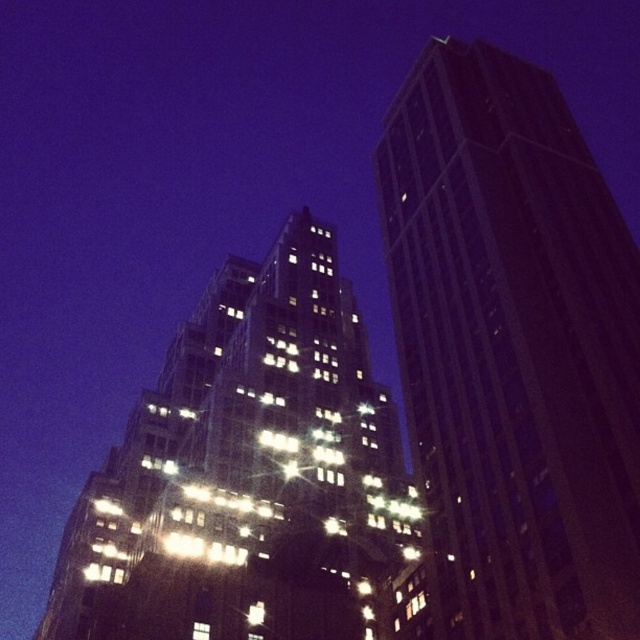
You are standing in the middle of the street between the dark glass skyscraper at right and the shiny glass building at center. Which building is closer to your right side?

The dark glass skyscraper at right is to the right of the shiny glass building at center, so it is closer to your right side.

You are a city planner assessing the impact of new construction on the skyline. Given the dark glass skyscraper at right and the shiny glass building at center, which structure would cast a larger shadow during the day? Please base your answer on their relative heights and the scene description.

The dark glass skyscraper at right is much taller than the shiny glass building at center, so it would cast a larger shadow during the day.